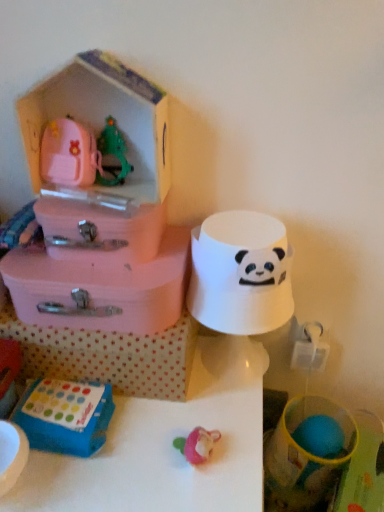
How much space does blue plastic toy at lower left, placed as the first toy when sorted from left to right, occupy vertically?

blue plastic toy at lower left, placed as the first toy when sorted from left to right, is 4.58 centimeters in height.

This screenshot has height=512, width=384. Describe the element at coordinates (108, 356) in the screenshot. I see `pink plastic storage box at upper left, the fourth storage box in the top-to-bottom sequence` at that location.

What is the approximate width of pink plastic storage box at upper left, the fourth storage box in the top-to-bottom sequence?

A: pink plastic storage box at upper left, the fourth storage box in the top-to-bottom sequence, is 26.10 centimeters in width.

The image size is (384, 512). What do you see at coordinates (240, 273) in the screenshot?
I see `white felt hat at right, marked as the first toy in a right-to-left arrangement` at bounding box center [240, 273].

The height and width of the screenshot is (512, 384). Identify the location of pink plastic suitcase at left, the third storage box in the top-to-bottom sequence. (100, 288).

Locate an element on the screen. This screenshot has width=384, height=512. blue plastic toy at lower left, positioned as the 2th toy in top-to-bottom order is located at coordinates (65, 416).

From the picture: Which is more to the left, white matte table at center or pink plastic suitcase at left, the 2th storage box ordered from the bottom?

From the viewer's perspective, white matte table at center appears more on the left side.

Does white matte table at center have a smaller size compared to pink plastic suitcase at left, the 2th storage box ordered from the bottom?

Actually, white matte table at center might be larger than pink plastic suitcase at left, the 2th storage box ordered from the bottom.

Are white matte table at center and pink plastic suitcase at left, the 2th storage box ordered from the bottom, making contact?

No, white matte table at center is not in contact with pink plastic suitcase at left, the 2th storage box ordered from the bottom.

Is point (243, 454) positioned after point (40, 279)?

No, (243, 454) is closer to viewer.

Which object is closer to the camera taking this photo, white felt hat at right, the 1th toy viewed from the top, or pink plastic suitcase at left, the third storage box in the top-to-bottom sequence?

white felt hat at right, the 1th toy viewed from the top.

Between white felt hat at right, positioned as the second toy in left-to-right order, and pink plastic suitcase at left, the third storage box in the top-to-bottom sequence, which one has smaller width?

With smaller width is white felt hat at right, positioned as the second toy in left-to-right order.

From the image's perspective, is white felt hat at right, the 1th toy viewed from the top, below pink plastic suitcase at left, the third storage box in the top-to-bottom sequence?

Yes, from the image's perspective, white felt hat at right, the 1th toy viewed from the top, is below pink plastic suitcase at left, the third storage box in the top-to-bottom sequence.

Does pink plastic storage box at upper left, which appears as the 1th storage box when ordered from the bottom, have a smaller size compared to white felt hat at right, marked as the first toy in a right-to-left arrangement?

No, pink plastic storage box at upper left, which appears as the 1th storage box when ordered from the bottom, is not smaller than white felt hat at right, marked as the first toy in a right-to-left arrangement.

Is pink plastic storage box at upper left, which appears as the 1th storage box when ordered from the bottom, beside white felt hat at right, the 2th toy in the bottom-to-top sequence?

No, pink plastic storage box at upper left, which appears as the 1th storage box when ordered from the bottom, is not with white felt hat at right, the 2th toy in the bottom-to-top sequence.

Is pink plastic storage box at upper left, the fourth storage box in the top-to-bottom sequence, situated inside white felt hat at right, the 1th toy viewed from the top, or outside?

pink plastic storage box at upper left, the fourth storage box in the top-to-bottom sequence, lies outside white felt hat at right, the 1th toy viewed from the top.

Which is nearer, (167, 375) or (224, 229)?

Answer: Positioned in front is point (224, 229).

Is white matte table at center aimed at pink plastic toy house at upper left, arranged as the 1th storage box when viewed from the top?

No, white matte table at center is not facing towards pink plastic toy house at upper left, arranged as the 1th storage box when viewed from the top.

Does white matte table at center have a greater height compared to pink plastic toy house at upper left, the fourth storage box when ordered from bottom to top?

Yes, white matte table at center is taller than pink plastic toy house at upper left, the fourth storage box when ordered from bottom to top.

The image size is (384, 512). Find the location of `table below the pink plastic toy house at upper left, arranged as the 1th storage box when viewed from the top (from a real-world perspective)`. table below the pink plastic toy house at upper left, arranged as the 1th storage box when viewed from the top (from a real-world perspective) is located at coordinates (166, 446).

Considering the points (204, 360) and (35, 147), which point is in front, point (204, 360) or point (35, 147)?

The point (35, 147) is in front.

Could you tell me if white matte table at center is turned towards pink plastic storage box at upper left, the fourth storage box in the top-to-bottom sequence?

No, white matte table at center is not oriented towards pink plastic storage box at upper left, the fourth storage box in the top-to-bottom sequence.

Is white matte table at center at the left side of pink plastic storage box at upper left, the fourth storage box in the top-to-bottom sequence?

Indeed, white matte table at center is positioned on the left side of pink plastic storage box at upper left, the fourth storage box in the top-to-bottom sequence.

Would you say white matte table at center is outside pink plastic storage box at upper left, the fourth storage box in the top-to-bottom sequence?

That's correct, white matte table at center is outside of pink plastic storage box at upper left, the fourth storage box in the top-to-bottom sequence.

From a real-world perspective, is pink plastic suitcase at upper left, the 3th storage box in the bottom-to-top sequence, on top of blue plastic toy at lower left, the second toy positioned from the right?

Correct, in the physical world, pink plastic suitcase at upper left, the 3th storage box in the bottom-to-top sequence, is higher than blue plastic toy at lower left, the second toy positioned from the right.

Would you consider pink plastic suitcase at upper left, the 3th storage box in the bottom-to-top sequence, to be distant from blue plastic toy at lower left, placed as the first toy when sorted from bottom to top?

That's not correct — pink plastic suitcase at upper left, the 3th storage box in the bottom-to-top sequence, is a little close to blue plastic toy at lower left, placed as the first toy when sorted from bottom to top.

Is pink plastic suitcase at upper left, which is the 2th storage box from top to bottom, wider or thinner than blue plastic toy at lower left, positioned as the 2th toy in top-to-bottom order?

Considering their sizes, pink plastic suitcase at upper left, which is the 2th storage box from top to bottom, looks broader than blue plastic toy at lower left, positioned as the 2th toy in top-to-bottom order.

From the image's perspective, is pink plastic suitcase at upper left, which is the 2th storage box from top to bottom, beneath blue plastic toy at lower left, placed as the first toy when sorted from bottom to top?

No.

Does blue plastic toy at lower left, placed as the first toy when sorted from bottom to top, appear on the right side of white felt hat at right, positioned as the second toy in left-to-right order?

Incorrect, blue plastic toy at lower left, placed as the first toy when sorted from bottom to top, is not on the right side of white felt hat at right, positioned as the second toy in left-to-right order.

Is blue plastic toy at lower left, placed as the first toy when sorted from bottom to top, facing away from white felt hat at right, positioned as the second toy in left-to-right order?

No, blue plastic toy at lower left, placed as the first toy when sorted from bottom to top, is not facing away from white felt hat at right, positioned as the second toy in left-to-right order.

From a real-world perspective, is blue plastic toy at lower left, placed as the first toy when sorted from left to right, positioned above or below white felt hat at right, the 2th toy in the bottom-to-top sequence?

From a real-world perspective, blue plastic toy at lower left, placed as the first toy when sorted from left to right, is physically below white felt hat at right, the 2th toy in the bottom-to-top sequence.

Is point (24, 412) positioned after point (257, 321)?

Yes, it is.

Find the location of a particular element. This screenshot has height=512, width=384. the 2nd storage box above the white matte table at center (from the image's perspective) is located at coordinates (100, 288).

The height and width of the screenshot is (512, 384). In order to click on toy lying on the right of pink plastic suitcase at left, the 2th storage box ordered from the bottom in this screenshot , I will do `click(240, 273)`.

Considering their positions, is pink plastic suitcase at left, the third storage box in the top-to-bottom sequence, positioned closer to white felt hat at right, positioned as the second toy in left-to-right order, than blue plastic toy at lower left, positioned as the 2th toy in top-to-bottom order?

Based on the image, pink plastic suitcase at left, the third storage box in the top-to-bottom sequence, appears to be nearer to white felt hat at right, positioned as the second toy in left-to-right order.

Which object lies further to the anchor point pink plastic suitcase at left, the 2th storage box ordered from the bottom, white matte table at center or pink plastic toy house at upper left, the fourth storage box when ordered from bottom to top?

white matte table at center lies further to pink plastic suitcase at left, the 2th storage box ordered from the bottom, than the other object.

From the image, which object appears to be nearer to white matte table at center, white felt hat at right, the 2th toy in the bottom-to-top sequence, or pink plastic suitcase at left, the third storage box in the top-to-bottom sequence?

The object closer to white matte table at center is pink plastic suitcase at left, the third storage box in the top-to-bottom sequence.

Considering their positions, is pink plastic suitcase at upper left, which is the 2th storage box from top to bottom, positioned further to blue plastic toy at lower left, placed as the first toy when sorted from left to right, than pink plastic storage box at upper left, which appears as the 1th storage box when ordered from the bottom?

pink plastic suitcase at upper left, which is the 2th storage box from top to bottom.

Which object lies further to the anchor point pink plastic suitcase at upper left, which is the 2th storage box from top to bottom, white felt hat at right, the 1th toy viewed from the top, or white matte table at center?

white matte table at center.

When comparing their distances from pink plastic storage box at upper left, which appears as the 1th storage box when ordered from the bottom, does white felt hat at right, the 1th toy viewed from the top, or pink plastic suitcase at upper left, the 3th storage box in the bottom-to-top sequence, seem further?

The object further to pink plastic storage box at upper left, which appears as the 1th storage box when ordered from the bottom, is pink plastic suitcase at upper left, the 3th storage box in the bottom-to-top sequence.

Based on their spatial positions, is white felt hat at right, positioned as the second toy in left-to-right order, or pink plastic toy house at upper left, the fourth storage box when ordered from bottom to top, further from blue plastic toy at lower left, placed as the first toy when sorted from bottom to top?

pink plastic toy house at upper left, the fourth storage box when ordered from bottom to top.

Based on their spatial positions, is white matte table at center or pink plastic suitcase at left, the 2th storage box ordered from the bottom, closer to pink plastic toy house at upper left, the fourth storage box when ordered from bottom to top?

pink plastic suitcase at left, the 2th storage box ordered from the bottom, is closer to pink plastic toy house at upper left, the fourth storage box when ordered from bottom to top.

Image resolution: width=384 pixels, height=512 pixels. I want to click on toy between pink plastic suitcase at upper left, which is the 2th storage box from top to bottom, and blue plastic toy at lower left, placed as the first toy when sorted from left to right, in the up-down direction, so click(240, 273).

Locate an element on the screen. This screenshot has height=512, width=384. storage box between white felt hat at right, marked as the first toy in a right-to-left arrangement, and white matte table at center from top to bottom is located at coordinates (108, 356).

Identify the location of toy between white felt hat at right, marked as the first toy in a right-to-left arrangement, and white matte table at center vertically. Image resolution: width=384 pixels, height=512 pixels. (65, 416).

Locate an element on the screen. Image resolution: width=384 pixels, height=512 pixels. storage box between pink plastic suitcase at left, the 2th storage box ordered from the bottom, and white matte table at center vertically is located at coordinates (108, 356).